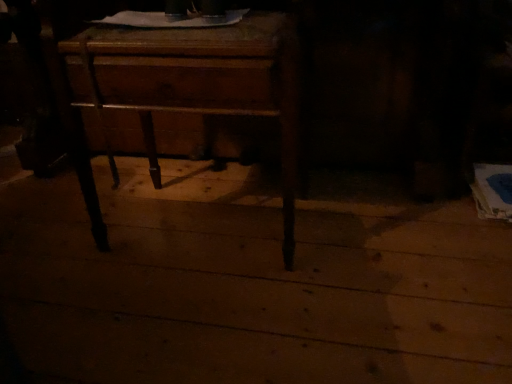
Where is `vacant region to the right of wooden drawer at center`? vacant region to the right of wooden drawer at center is located at coordinates (381, 266).